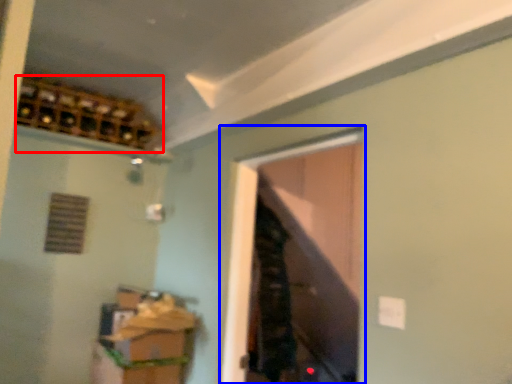
Question: Which of the following is the closest to the observer, wine cabinet (highlighted by a red box) or window (highlighted by a blue box)?

Choices:
 (A) wine cabinet
 (B) window

Answer: (B)